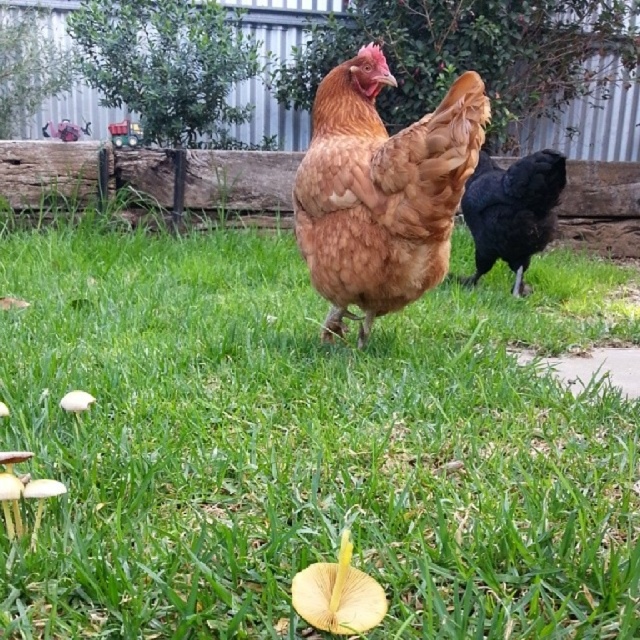
Between green grass at center and brown feathered chicken at center, which one appears on the left side from the viewer's perspective?

Positioned to the left is brown feathered chicken at center.

Between green grass at center and brown feathered chicken at center, which one appears on the right side from the viewer's perspective?

From the viewer's perspective, green grass at center appears more on the right side.

Is point (356, 353) closer to camera compared to point (368, 225)?

No, it is behind (368, 225).

This screenshot has height=640, width=640. What are the coordinates of `green grass at center` in the screenshot? It's located at (308, 444).

Which of these two, brown feathered chicken at center or shiny black chicken at right, stands shorter?

With less height is shiny black chicken at right.

Does brown feathered chicken at center appear over shiny black chicken at right?

Actually, brown feathered chicken at center is below shiny black chicken at right.

Measure the distance between brown feathered chicken at center and camera.

5.57 feet

The height and width of the screenshot is (640, 640). In order to click on brown feathered chicken at center in this screenshot , I will do tap(381, 189).

Can you confirm if green grass at center is positioned to the left of shiny black chicken at right?

Yes, green grass at center is to the left of shiny black chicken at right.

Who is shorter, green grass at center or shiny black chicken at right?

Standing shorter between the two is shiny black chicken at right.

Who is more forward, (x=625, y=339) or (x=496, y=227)?

Point (x=625, y=339) is more forward.

Find the location of a particular element. The height and width of the screenshot is (640, 640). green grass at center is located at coordinates (308, 444).